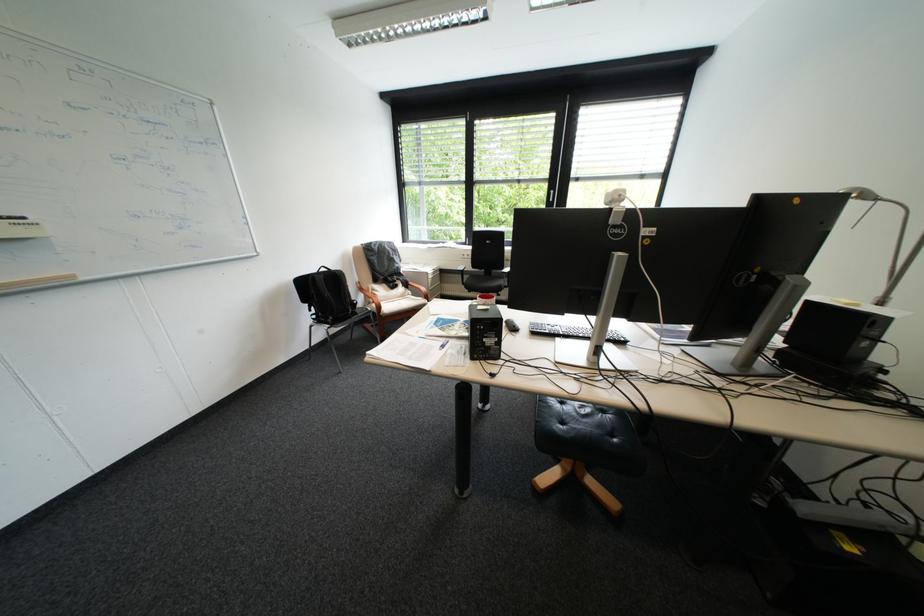
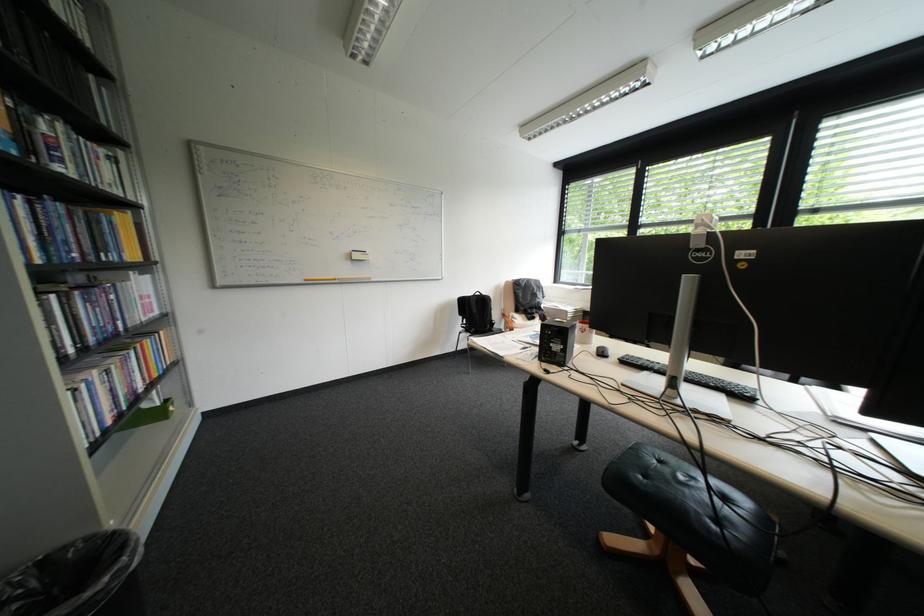
Question: The camera is either moving clockwise (left) or counter-clockwise (right) around the object. The first image is from the beginning of the video and the second image is from the end. Is the camera moving left or right when shooting the video?

Choices:
 (A) Left
 (B) Right

Answer: (B)